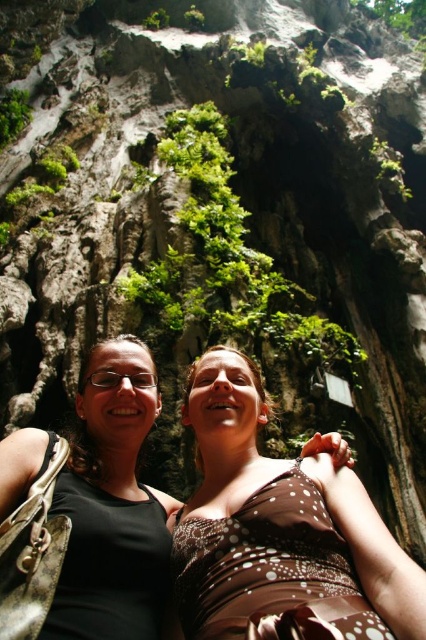
Question: Among these points, which one is farthest from the camera?

Choices:
 (A) (58, 577)
 (B) (382, 563)

Answer: (B)

Question: Does brown dotted dress at center appear over black fabric at center?

Choices:
 (A) no
 (B) yes

Answer: (A)

Question: Which object appears farthest from the camera in this image?

Choices:
 (A) brown dotted dress at center
 (B) black fabric at center

Answer: (B)

Question: Does brown dotted dress at center have a larger size compared to black fabric at center?

Choices:
 (A) yes
 (B) no

Answer: (A)

Question: Does brown dotted dress at center have a lesser width compared to black fabric at center?

Choices:
 (A) no
 (B) yes

Answer: (A)